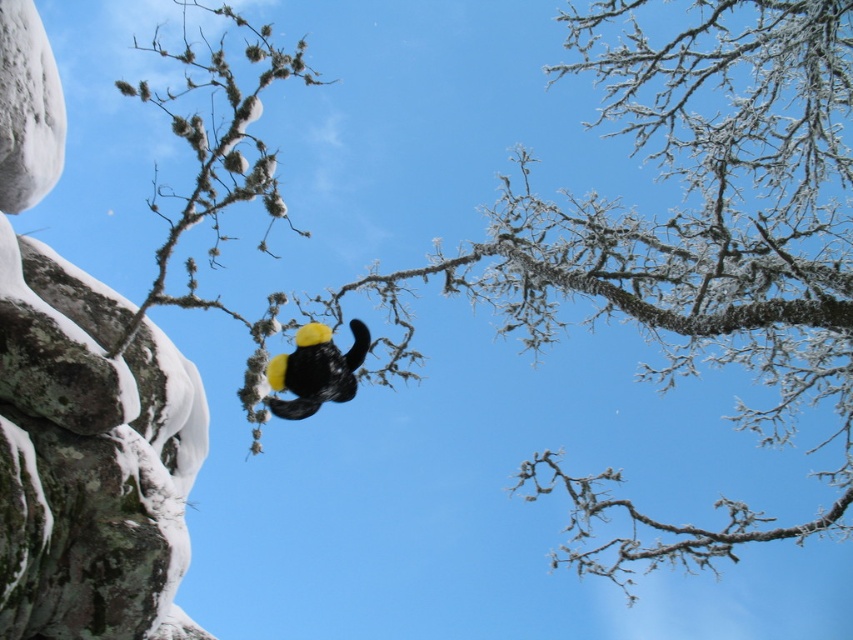
How far apart are frosted branches at center and yellow matte hat at center?

frosted branches at center is 4.51 meters from yellow matte hat at center.

Between frosted branches at center and yellow matte hat at center, which one is positioned higher?

frosted branches at center is above.

What do you see at coordinates (695, 241) in the screenshot?
I see `frosted branches at center` at bounding box center [695, 241].

Find the location of `frosted branches at center`. frosted branches at center is located at coordinates (695, 241).